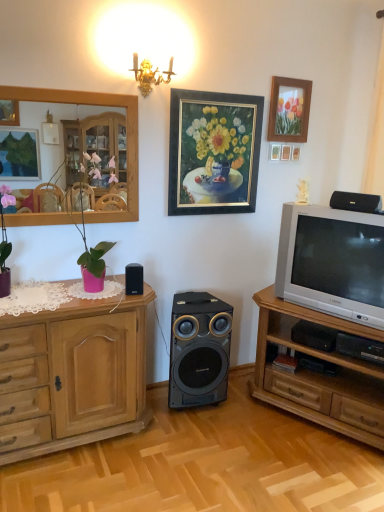
Identify the location of vacant space situated above wooden mirror at upper left (from a real-world perspective). (67, 87).